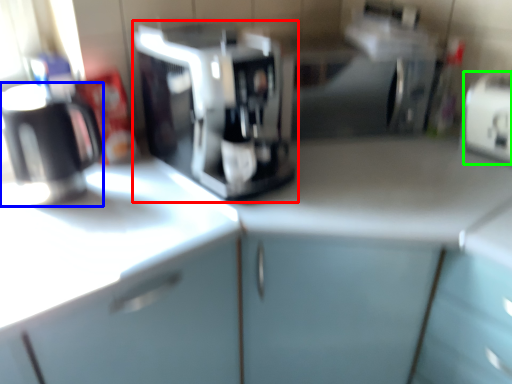
Question: Estimate the real-world distances between objects in this image. Which object is closer to coffee maker (highlighted by a red box), kitchen appliance (highlighted by a blue box) or appliance (highlighted by a green box)?

Choices:
 (A) kitchen appliance
 (B) appliance

Answer: (A)